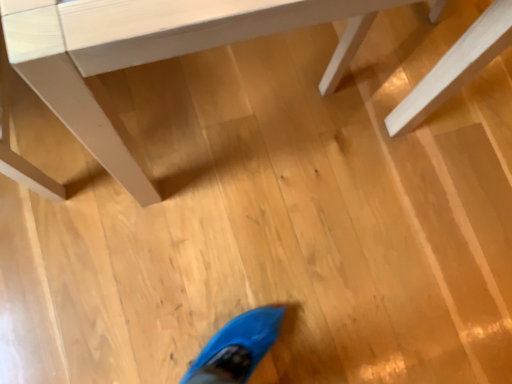
The width and height of the screenshot is (512, 384). Describe the element at coordinates (150, 51) in the screenshot. I see `white matte table at upper center` at that location.

Image resolution: width=512 pixels, height=384 pixels. I want to click on white matte table at upper center, so click(150, 51).

Image resolution: width=512 pixels, height=384 pixels. Identify the location of white matte table at upper center. (150, 51).